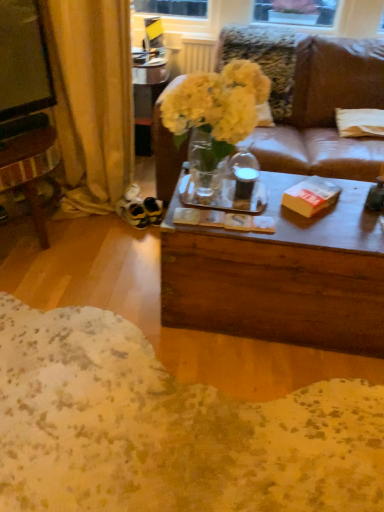
Measure the distance between white fabric pillow at right and camera.

They are 7.60 feet apart.

What do you see at coordinates (148, 56) in the screenshot? This screenshot has width=384, height=512. I see `metallic silver box at upper center` at bounding box center [148, 56].

At what (x,y) coordinates should I click in order to perform the action: click on gold fabric curtain at left. Please return your answer as a coordinate pair (x, y). This screenshot has height=512, width=384. Looking at the image, I should click on [x=92, y=102].

Find the location of a particular element. white fabric pillow at right is located at coordinates (360, 122).

Between metallic silver box at upper center and yellow paper book at center, which one appears on the left side from the viewer's perspective?

metallic silver box at upper center is more to the left.

Does metallic silver box at upper center have a larger size compared to yellow paper book at center?

Yes.

From a real-world perspective, is metallic silver box at upper center under yellow paper book at center?

No, from a real-world perspective, metallic silver box at upper center is not beneath yellow paper book at center.

Would you consider metallic silver box at upper center to be distant from yellow paper book at center?

metallic silver box at upper center is far away from yellow paper book at center.

This screenshot has width=384, height=512. What are the coordinates of `book to the right of translucent glass vase at center` in the screenshot? It's located at (310, 196).

Is yellow paper book at center oriented towards translucent glass vase at center?

No.

Which is closer, (326, 183) or (220, 141)?

The point (220, 141) is closer to the camera.

Between yellow paper book at center and translucent glass vase at center, which one appears on the left side from the viewer's perspective?

Positioned to the left is translucent glass vase at center.

Is metallic silver box at upper center taller than gold fabric curtain at left?

In fact, metallic silver box at upper center may be shorter than gold fabric curtain at left.

Is gold fabric curtain at left located within metallic silver box at upper center?

That's incorrect, gold fabric curtain at left is not inside metallic silver box at upper center.

In the image, is metallic silver box at upper center positioned in front of or behind gold fabric curtain at left?

In the image, metallic silver box at upper center appears behind gold fabric curtain at left.

How different are the orientations of white fabric pillow at right and gold fabric curtain at left in degrees?

The angle between the facing direction of white fabric pillow at right and the facing direction of gold fabric curtain at left is 1.61 degrees.

Is white fabric pillow at right touching gold fabric curtain at left?

No, white fabric pillow at right is not making contact with gold fabric curtain at left.

Is white fabric pillow at right facing away from gold fabric curtain at left?

That's not correct — white fabric pillow at right is not looking away from gold fabric curtain at left.

Is gold fabric curtain at left located within white fabric pillow at right?

No, gold fabric curtain at left is not a part of white fabric pillow at right.

Based on the photo, is translucent glass vase at center positioned with its back to metallic silver box at upper center?

No, metallic silver box at upper center is not at the back of translucent glass vase at center.

Based on the photo, does translucent glass vase at center touch metallic silver box at upper center?

They are not placed beside each other.

Who is taller, translucent glass vase at center or metallic silver box at upper center?

translucent glass vase at center is taller.

Where is `flower that is on the right side of metallic silver box at upper center`? flower that is on the right side of metallic silver box at upper center is located at coordinates (217, 102).

Which object is wider, metallic silver box at upper center or white fabric pillow at right?

white fabric pillow at right is wider.

Between metallic silver box at upper center and white fabric pillow at right, which one has less height?

metallic silver box at upper center.

Is metallic silver box at upper center looking in the opposite direction of white fabric pillow at right?

That's not correct — metallic silver box at upper center is not looking away from white fabric pillow at right.

Between metallic silver box at upper center and white fabric pillow at right, which one appears on the right side from the viewer's perspective?

white fabric pillow at right is more to the right.

Does white fabric pillow at right have a smaller size compared to yellow paper book at center?

Incorrect, white fabric pillow at right is not smaller in size than yellow paper book at center.

Is yellow paper book at center completely or partially inside white fabric pillow at right?

No, yellow paper book at center is not inside white fabric pillow at right.

From a real-world perspective, is white fabric pillow at right physically located above or below yellow paper book at center?

white fabric pillow at right is situated lower than yellow paper book at center in the real world.

Find the location of `book in front of the white fabric pillow at right`. book in front of the white fabric pillow at right is located at coordinates (310, 196).

The height and width of the screenshot is (512, 384). I want to click on book below the metallic silver box at upper center (from the image's perspective), so click(x=310, y=196).

Identify the location of flower on the left of yellow paper book at center. (217, 102).

Looking at the image, which one is located further to white fabric pillow at right, translucent glass vase at center or yellow paper book at center?

translucent glass vase at center is further to white fabric pillow at right.

From the image, which object appears to be farther from white fabric pillow at right, translucent glass vase at center or gold fabric curtain at left?

gold fabric curtain at left is positioned further to the anchor white fabric pillow at right.

Which object lies further to the anchor point gold fabric curtain at left, white fabric pillow at right or metallic silver box at upper center?

Among the two, white fabric pillow at right is located further to gold fabric curtain at left.

Which object lies further to the anchor point white fabric pillow at right, gold fabric curtain at left or yellow paper book at center?

gold fabric curtain at left lies further to white fabric pillow at right than the other object.

Based on their spatial positions, is metallic silver box at upper center or gold fabric curtain at left further from translucent glass vase at center?

metallic silver box at upper center is positioned further to the anchor translucent glass vase at center.

Considering their positions, is yellow paper book at center positioned further to metallic silver box at upper center than white fabric pillow at right?

The object further to metallic silver box at upper center is yellow paper book at center.

Which object lies nearer to the anchor point gold fabric curtain at left, metallic silver box at upper center or translucent glass vase at center?

The object closer to gold fabric curtain at left is translucent glass vase at center.

Based on their spatial positions, is gold fabric curtain at left or translucent glass vase at center further from metallic silver box at upper center?

Among the two, translucent glass vase at center is located further to metallic silver box at upper center.

This screenshot has height=512, width=384. I want to click on flower between yellow paper book at center and white fabric pillow at right from front to back, so click(x=217, y=102).

You are a GUI agent. You are given a task and a screenshot of the screen. Output one action in this format:
    pyautogui.click(x=<x>, y=<y>)
    Task: Click on the box between gold fabric curtain at left and white fabric pillow at right from left to right
    This screenshot has height=512, width=384.
    Given the screenshot: What is the action you would take?
    pyautogui.click(x=148, y=56)

Identify the location of book between metallic silver box at upper center and white fabric pillow at right in the horizontal direction. (310, 196).

The width and height of the screenshot is (384, 512). Identify the location of book situated between gold fabric curtain at left and white fabric pillow at right from left to right. (310, 196).